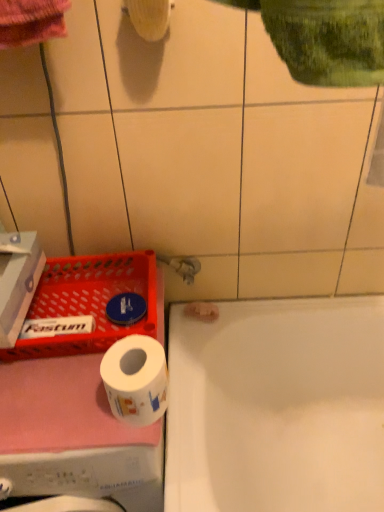
Question: Could white glossy bathtub at lower right be considered to be inside white glossy washing machine at lower left?

Choices:
 (A) no
 (B) yes

Answer: (A)

Question: Does white glossy washing machine at lower left have a lesser width compared to white glossy bathtub at lower right?

Choices:
 (A) no
 (B) yes

Answer: (A)

Question: From a real-world perspective, does white glossy washing machine at lower left stand above white glossy bathtub at lower right?

Choices:
 (A) no
 (B) yes

Answer: (B)

Question: Are white glossy washing machine at lower left and white glossy bathtub at lower right far apart?

Choices:
 (A) yes
 (B) no

Answer: (B)

Question: From the image's perspective, would you say white glossy washing machine at lower left is positioned over white glossy bathtub at lower right?

Choices:
 (A) yes
 (B) no

Answer: (A)

Question: Is white glossy bathtub at lower right to the left or to the right of white matte toilet paper at lower left in the image?

Choices:
 (A) right
 (B) left

Answer: (A)

Question: From the image's perspective, relative to white matte toilet paper at lower left, is white glossy bathtub at lower right above or below?

Choices:
 (A) below
 (B) above

Answer: (A)

Question: From a real-world perspective, relative to white matte toilet paper at lower left, is white glossy bathtub at lower right vertically above or below?

Choices:
 (A) above
 (B) below

Answer: (B)

Question: Is white glossy bathtub at lower right taller or shorter than white matte toilet paper at lower left?

Choices:
 (A) tall
 (B) short

Answer: (A)

Question: Considering the positions of white glossy bathtub at lower right and white glossy washing machine at lower left in the image, is white glossy bathtub at lower right taller or shorter than white glossy washing machine at lower left?

Choices:
 (A) tall
 (B) short

Answer: (B)

Question: Would you say white glossy bathtub at lower right is inside or outside white glossy washing machine at lower left?

Choices:
 (A) outside
 (B) inside

Answer: (A)

Question: From a real-world perspective, is white glossy bathtub at lower right above or below white glossy washing machine at lower left?

Choices:
 (A) below
 (B) above

Answer: (A)

Question: Is white glossy bathtub at lower right in front of or behind white glossy washing machine at lower left in the image?

Choices:
 (A) behind
 (B) front

Answer: (A)

Question: In the image, is white matte toilet paper at lower left positioned in front of or behind white glossy washing machine at lower left?

Choices:
 (A) front
 (B) behind

Answer: (B)

Question: Considering the positions of white matte toilet paper at lower left and white glossy washing machine at lower left in the image, is white matte toilet paper at lower left wider or thinner than white glossy washing machine at lower left?

Choices:
 (A) thin
 (B) wide

Answer: (A)